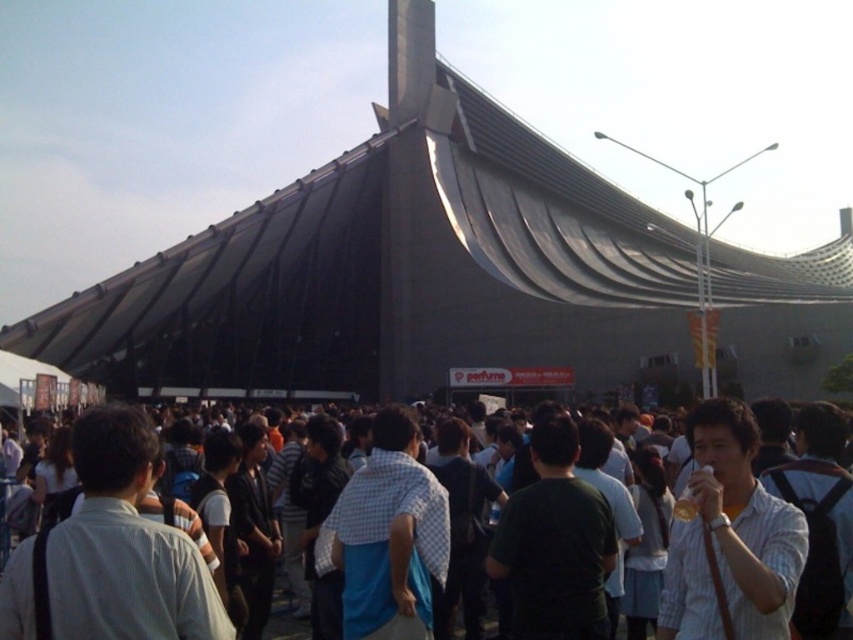
Question: Which point is farther to the camera?

Choices:
 (A) dark casual clothing at center
 (B) white striped shirt at center

Answer: (B)

Question: Which object is farther from the camera taking this photo?

Choices:
 (A) white striped shirt at center
 (B) dark casual clothing at center

Answer: (A)

Question: Is dark casual clothing at center bigger than white striped shirt at center?

Choices:
 (A) no
 (B) yes

Answer: (B)

Question: Where is dark casual clothing at center located in relation to white striped shirt at center in the image?

Choices:
 (A) above
 (B) below

Answer: (B)

Question: Does dark casual clothing at center appear on the right side of white striped shirt at center?

Choices:
 (A) yes
 (B) no

Answer: (B)